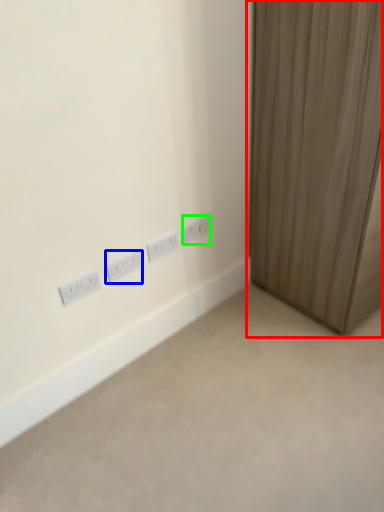
Question: Which object is positioned closest to curtain (highlighted by a red box)? Select from power plugs and sockets (highlighted by a blue box) and power plugs and sockets (highlighted by a green box).

Choices:
 (A) power plugs and sockets
 (B) power plugs and sockets

Answer: (B)